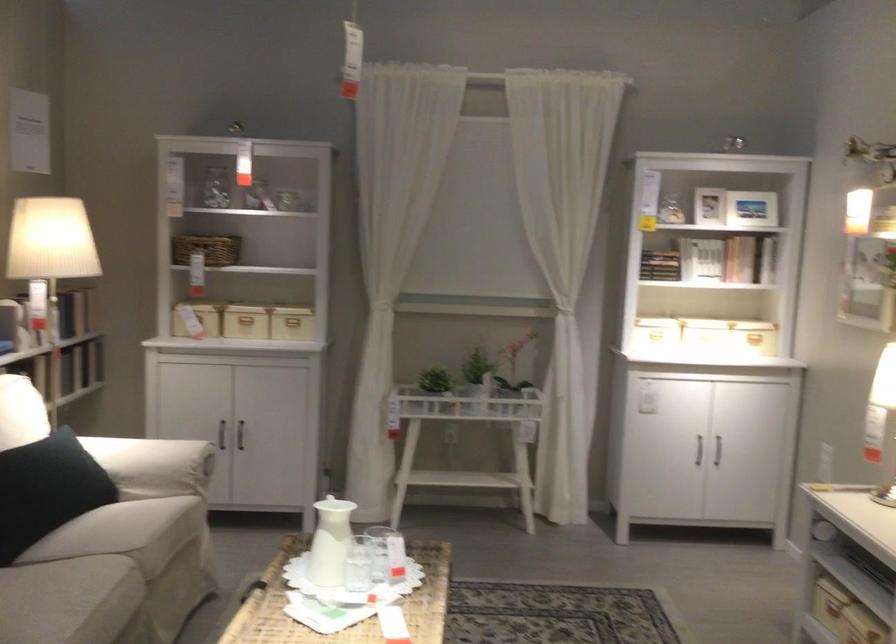
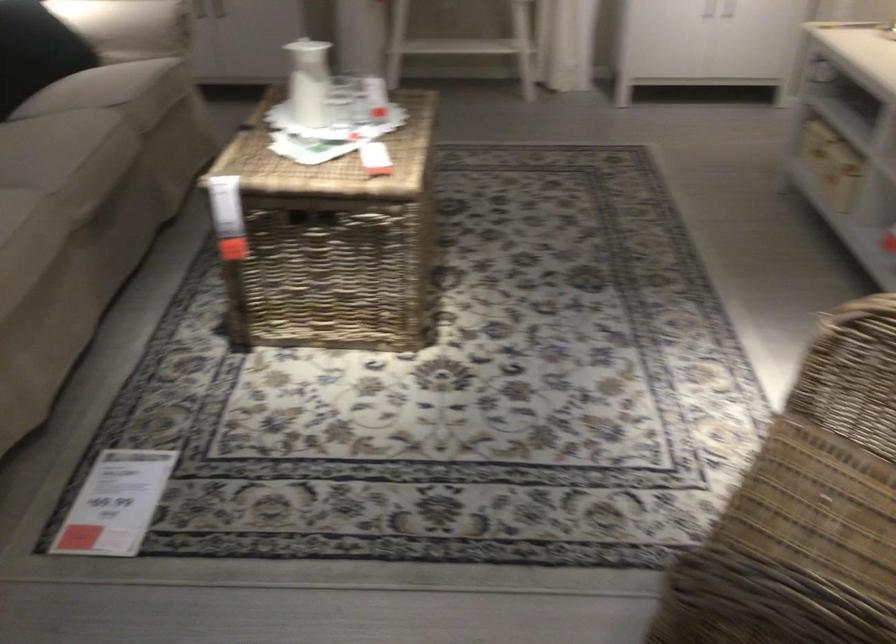
Locate, in the second image, the point that corresponds to (330,547) in the first image.

(308, 82)